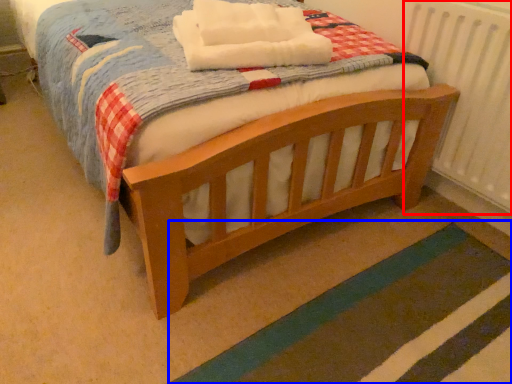
Question: Among these objects, which one is nearest to the camera, radiator (highlighted by a red box) or strip (highlighted by a blue box)?

Choices:
 (A) radiator
 (B) strip

Answer: (B)